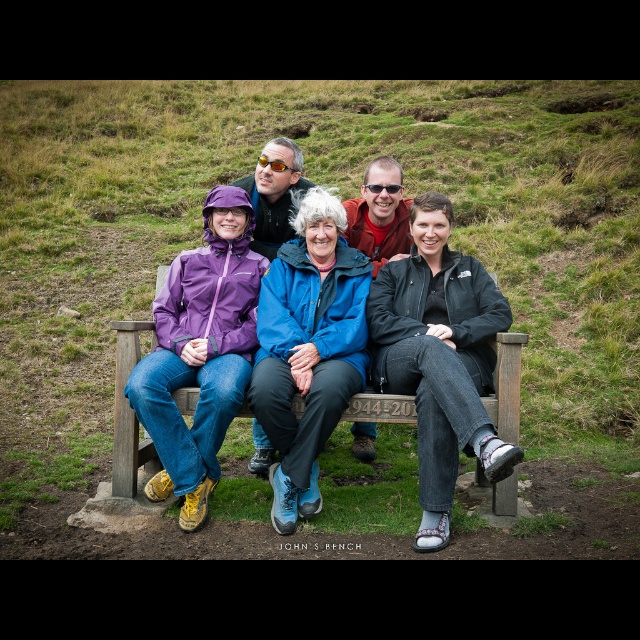
Is point (476, 328) positioned after point (284, 371)?

Yes.

Who is taller, purple waterproof jacket at center or blue waterproof jacket at center?

blue waterproof jacket at center

Is point (294, 436) closer to viewer compared to point (314, 374)?

Yes.

Locate an element on the screen. The width and height of the screenshot is (640, 640). purple waterproof jacket at center is located at coordinates (307, 352).

Is the position of purple waterproof jacket at center less distant than that of wooden bench at center?

Yes, it is.

Between purple waterproof jacket at center and wooden bench at center, which one is positioned lower?

wooden bench at center is lower down.

You are a GUI agent. You are given a task and a screenshot of the screen. Output one action in this format:
    pyautogui.click(x=<x>, y=<y>)
    Task: Click on the purple waterproof jacket at center
    This screenshot has width=640, height=640.
    Given the screenshot: What is the action you would take?
    pyautogui.click(x=307, y=352)

I want to click on purple waterproof jacket at center, so click(x=307, y=352).

Is matte purple jacket at left to the right of wooden bench at center from the viewer's perspective?

No, matte purple jacket at left is not to the right of wooden bench at center.

Who is more distant from viewer, (154, 362) or (500, 337)?

Positioned behind is point (154, 362).

Where is `matte purple jacket at left`? The width and height of the screenshot is (640, 640). matte purple jacket at left is located at coordinates pos(200,353).